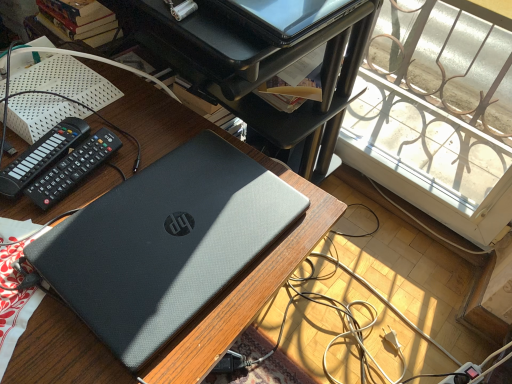
The height and width of the screenshot is (384, 512). Find the location of `vacant space in front of black plastic remote at left, which ranks as the 2th control in right-to-left order`. vacant space in front of black plastic remote at left, which ranks as the 2th control in right-to-left order is located at coordinates (30, 254).